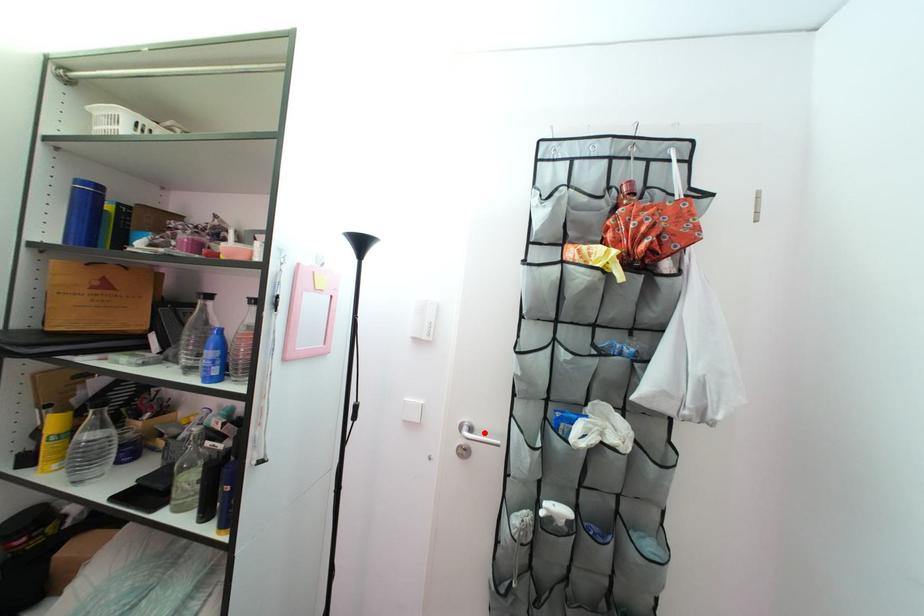
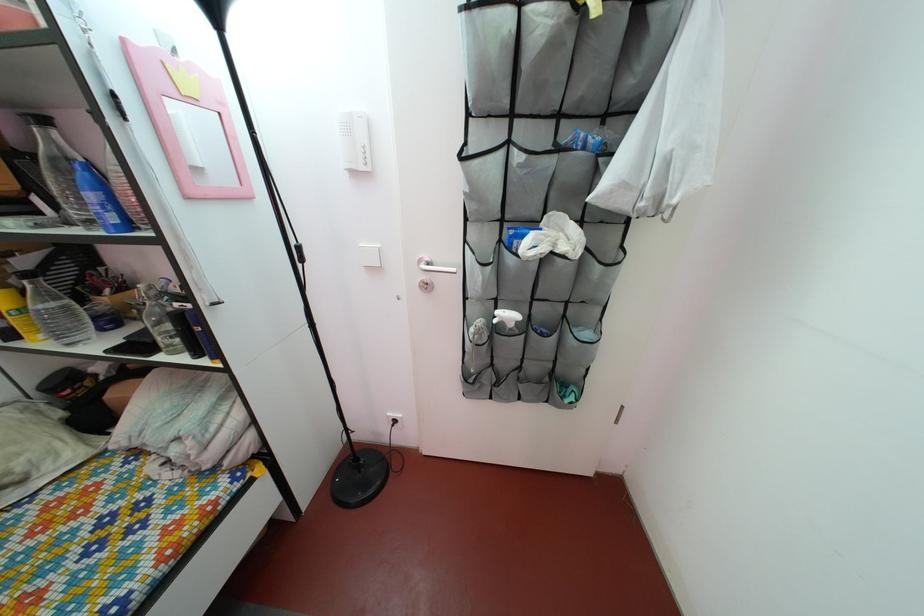
The point at the highlighted location is marked in the first image. Where is the corresponding point in the second image?

(443, 268)